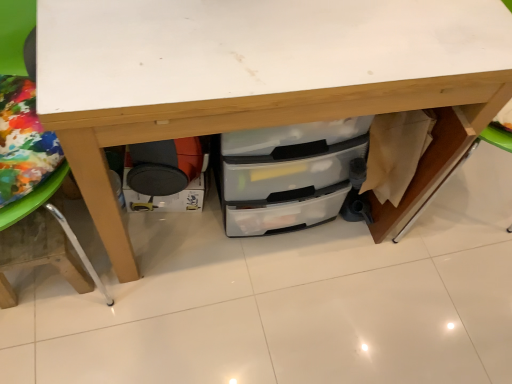
Question: Relative to matte black drawer at lower left, is wooden table leg at lower left in front or behind?

Choices:
 (A) front
 (B) behind

Answer: (A)

Question: Is wooden table leg at lower left wider or thinner than matte black drawer at lower left?

Choices:
 (A) wide
 (B) thin

Answer: (A)

Question: Based on their relative distances, which object is nearer to the matte black drawer at lower left?

Choices:
 (A) transparent plastic drawers at center
 (B) wooden table leg at lower left

Answer: (B)

Question: Considering the real-world distances, which object is farthest from the matte black drawer at lower left?

Choices:
 (A) wooden table leg at lower left
 (B) transparent plastic drawers at center

Answer: (B)